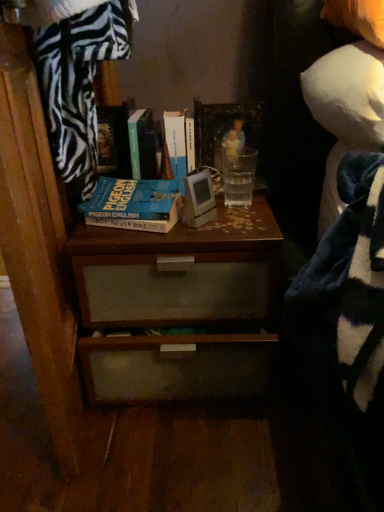
This screenshot has width=384, height=512. Identify the location of vacant space in front of blue matte book at center, positioned as the 1th book in left-to-right order. (137, 238).